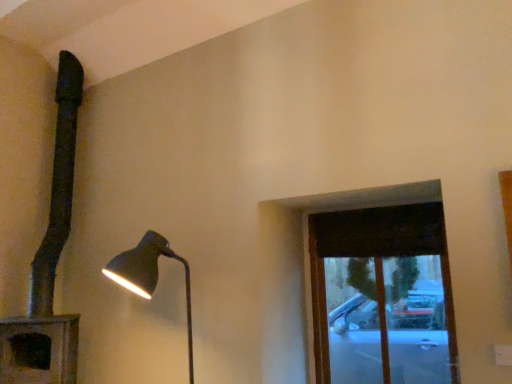
How much space does matte black lamp at left, which is counted as the 1th lamp, starting from the left, occupy vertically?

The height of matte black lamp at left, which is counted as the 1th lamp, starting from the left, is 2.69 meters.

What is the approximate height of dark wood window at upper right?

dark wood window at upper right is 1.18 meters in height.

Image resolution: width=512 pixels, height=384 pixels. What are the coordinates of `matte black lamp at left, marked as the 2th lamp in a left-to-right arrangement` in the screenshot? It's located at (149, 275).

Considering the relative positions of dark wood window at upper right and matte black lamp at left, which is counted as the 2th lamp, starting from the right, in the image provided, is dark wood window at upper right to the left of matte black lamp at left, which is counted as the 2th lamp, starting from the right, from the viewer's perspective?

In fact, dark wood window at upper right is to the right of matte black lamp at left, which is counted as the 2th lamp, starting from the right.

From a real-world perspective, is dark wood window at upper right under matte black lamp at left, which is counted as the 2th lamp, starting from the right?

Yes, from a real-world perspective, dark wood window at upper right is under matte black lamp at left, which is counted as the 2th lamp, starting from the right.

Could you tell me if dark wood window at upper right is facing matte black lamp at left, which is counted as the 2th lamp, starting from the right?

No, dark wood window at upper right is not facing towards matte black lamp at left, which is counted as the 2th lamp, starting from the right.

Is dark wood window at upper right beside matte black lamp at left, which is counted as the 1th lamp, starting from the left?

No, dark wood window at upper right is not touching matte black lamp at left, which is counted as the 1th lamp, starting from the left.

Which of these two, matte black lamp at left, which is counted as the 1th lamp, starting from the left, or dark wood window at upper right, is wider?

matte black lamp at left, which is counted as the 1th lamp, starting from the left.

Could you measure the distance between matte black lamp at left, which is counted as the 1th lamp, starting from the left, and dark wood window at upper right?

matte black lamp at left, which is counted as the 1th lamp, starting from the left, is 3.00 meters away from dark wood window at upper right.

Does matte black lamp at left, which is counted as the 1th lamp, starting from the left, turn towards dark wood window at upper right?

No, matte black lamp at left, which is counted as the 1th lamp, starting from the left, does not turn towards dark wood window at upper right.

Locate an element on the screen. This screenshot has height=384, width=512. window in front of the matte black lamp at left, which is counted as the 2th lamp, starting from the right is located at coordinates (382, 296).

Is matte black lamp at left, which is counted as the 1th lamp, starting from the left, facing towards matte black lamp at left, marked as the 2th lamp in a left-to-right arrangement?

Yes, matte black lamp at left, which is counted as the 1th lamp, starting from the left, is oriented towards matte black lamp at left, marked as the 2th lamp in a left-to-right arrangement.

Does point (12, 352) appear closer or farther from the camera than point (143, 296)?

Point (12, 352) is positioned farther from the camera compared to point (143, 296).

Does matte black lamp at left, which is counted as the 2th lamp, starting from the right, come in front of matte black lamp at left, marked as the 2th lamp in a left-to-right arrangement?

No, matte black lamp at left, which is counted as the 2th lamp, starting from the right, is behind matte black lamp at left, marked as the 2th lamp in a left-to-right arrangement.

Is point (148, 234) closer or farther from the camera than point (359, 352)?

Point (148, 234) appears to be closer to the viewer than point (359, 352).

Is matte black lamp at left, marked as the 2th lamp in a left-to-right arrangement, to the left of dark wood window at upper right from the viewer's perspective?

Indeed, matte black lamp at left, marked as the 2th lamp in a left-to-right arrangement, is positioned on the left side of dark wood window at upper right.

What are the coordinates of `window that appears on the right of matte black lamp at left, marked as the 2th lamp in a left-to-right arrangement` in the screenshot? It's located at (382, 296).

Which of these two, dark wood window at upper right or matte black lamp at left, the first lamp in the right-to-left sequence, is bigger?

With larger size is matte black lamp at left, the first lamp in the right-to-left sequence.

Considering the positions of objects dark wood window at upper right and matte black lamp at left, marked as the 2th lamp in a left-to-right arrangement, in the image provided, who is in front, dark wood window at upper right or matte black lamp at left, marked as the 2th lamp in a left-to-right arrangement,?

matte black lamp at left, marked as the 2th lamp in a left-to-right arrangement, is more forward.

Is dark wood window at upper right facing away from matte black lamp at left, marked as the 2th lamp in a left-to-right arrangement?

No, matte black lamp at left, marked as the 2th lamp in a left-to-right arrangement, is not at the back of dark wood window at upper right.

Would you say dark wood window at upper right contains matte black lamp at left, the first lamp in the right-to-left sequence?

Definitely not — matte black lamp at left, the first lamp in the right-to-left sequence, is not inside dark wood window at upper right.

Looking at this image, in the image, is matte black lamp at left, the first lamp in the right-to-left sequence, positioned in front of or behind matte black lamp at left, which is counted as the 1th lamp, starting from the left?

Clearly, matte black lamp at left, the first lamp in the right-to-left sequence, is in front of matte black lamp at left, which is counted as the 1th lamp, starting from the left.

Between matte black lamp at left, the first lamp in the right-to-left sequence, and matte black lamp at left, which is counted as the 2th lamp, starting from the right, which one has less height?

matte black lamp at left, the first lamp in the right-to-left sequence, is shorter.

This screenshot has height=384, width=512. What are the coordinates of `lamp in front of the matte black lamp at left, which is counted as the 1th lamp, starting from the left` in the screenshot? It's located at (149, 275).

From the image's perspective, is matte black lamp at left, the first lamp in the right-to-left sequence, above or below matte black lamp at left, which is counted as the 2th lamp, starting from the right?

Clearly, from the image's perspective, matte black lamp at left, the first lamp in the right-to-left sequence, is below matte black lamp at left, which is counted as the 2th lamp, starting from the right.

Starting from the dark wood window at upper right, which lamp is the 2nd one to the left? Please provide its 2D coordinates.

[(49, 261)]

Locate an element on the screen. Image resolution: width=512 pixels, height=384 pixels. window located underneath the matte black lamp at left, which is counted as the 1th lamp, starting from the left (from a real-world perspective) is located at coordinates (382, 296).

Which object lies nearer to the anchor point dark wood window at upper right, matte black lamp at left, marked as the 2th lamp in a left-to-right arrangement, or matte black lamp at left, which is counted as the 2th lamp, starting from the right?

matte black lamp at left, marked as the 2th lamp in a left-to-right arrangement.

Based on their spatial positions, is matte black lamp at left, marked as the 2th lamp in a left-to-right arrangement, or dark wood window at upper right closer to matte black lamp at left, which is counted as the 1th lamp, starting from the left?

The object closer to matte black lamp at left, which is counted as the 1th lamp, starting from the left, is matte black lamp at left, marked as the 2th lamp in a left-to-right arrangement.

Considering their positions, is matte black lamp at left, which is counted as the 2th lamp, starting from the right, positioned closer to dark wood window at upper right than matte black lamp at left, marked as the 2th lamp in a left-to-right arrangement?

matte black lamp at left, marked as the 2th lamp in a left-to-right arrangement, is closer to dark wood window at upper right.

From the image, which object appears to be farther from matte black lamp at left, the first lamp in the right-to-left sequence, dark wood window at upper right or matte black lamp at left, which is counted as the 1th lamp, starting from the left?

dark wood window at upper right is further to matte black lamp at left, the first lamp in the right-to-left sequence.

When comparing their distances from matte black lamp at left, which is counted as the 2th lamp, starting from the right, does dark wood window at upper right or matte black lamp at left, marked as the 2th lamp in a left-to-right arrangement, seem closer?

Based on the image, matte black lamp at left, marked as the 2th lamp in a left-to-right arrangement, appears to be nearer to matte black lamp at left, which is counted as the 2th lamp, starting from the right.

Based on their spatial positions, is matte black lamp at left, which is counted as the 2th lamp, starting from the right, or dark wood window at upper right closer to matte black lamp at left, the first lamp in the right-to-left sequence?

matte black lamp at left, which is counted as the 2th lamp, starting from the right, is positioned closer to the anchor matte black lamp at left, the first lamp in the right-to-left sequence.

Where is `lamp between matte black lamp at left, which is counted as the 2th lamp, starting from the right, and dark wood window at upper right`? The width and height of the screenshot is (512, 384). lamp between matte black lamp at left, which is counted as the 2th lamp, starting from the right, and dark wood window at upper right is located at coordinates (149, 275).